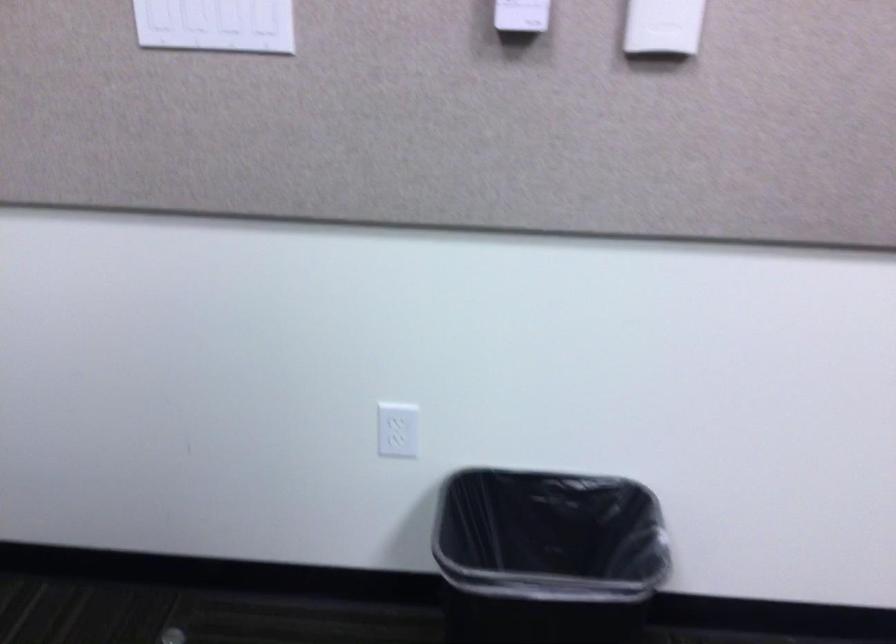
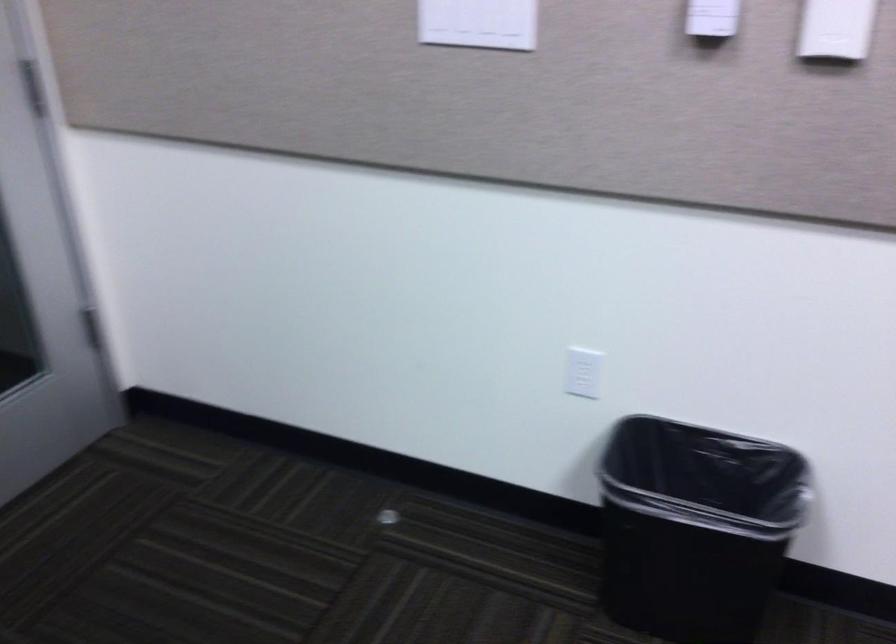
Question: Based on the continuous images, in which direction is the camera rotating? Reply with the corresponding letter.

Choices:
 (A) Left
 (B) Right
 (C) Up
 (D) Down

Answer: (A)